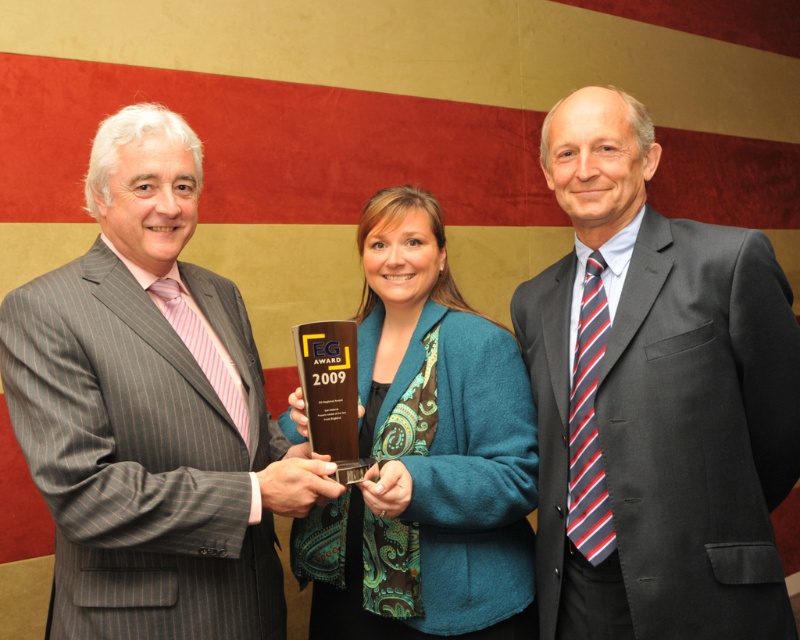
From the picture: You are organizing a photo shoot and need to arrange the dark gray suit at right and the teal fabric jacket at center in a line from left to right. Based on their current positions, which order should you follow?

The dark gray suit at right is positioned on the right side of the teal fabric jacket at center, so the correct order from left to right would be teal fabric jacket at center followed by dark gray suit at right.

You are a photographer at an award ceremony. You need to capture a photo of the dark gray suit at right and the gray pinstripe suit at center. The camera you are using has a minimum focus distance of 26 inches. Will you be able to focus on both subjects clearly?

The dark gray suit at right and gray pinstripe suit at center are 26.13 inches apart. Since the camera requires a minimum focus distance of 26 inches, the 26.13 inches between them is just enough to allow both subjects to be in focus.

You are standing in the award ceremony scene. You need to determine which of the two points, point (708,408) or point (66,289), is closer to you. Which one is closer?

Point (708,408) is further to the camera than point (66,289), so the closer point to you is point (66,289).